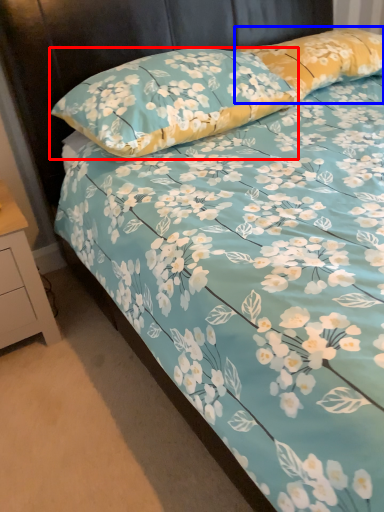
Question: Among these objects, which one is nearest to the camera, pillow (highlighted by a red box) or pillow (highlighted by a blue box)?

Choices:
 (A) pillow
 (B) pillow

Answer: (A)